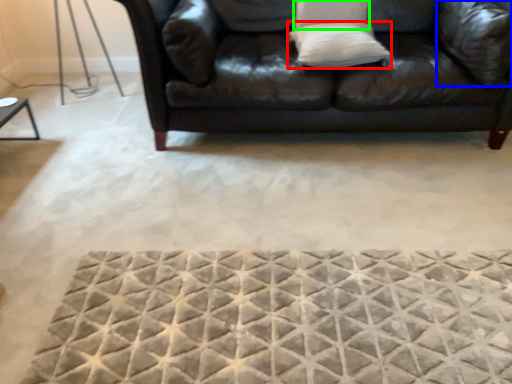
Question: Which object is positioned farthest from pillow (highlighted by a red box)? Select from pillow (highlighted by a blue box) and pillow (highlighted by a green box).

Choices:
 (A) pillow
 (B) pillow

Answer: (A)